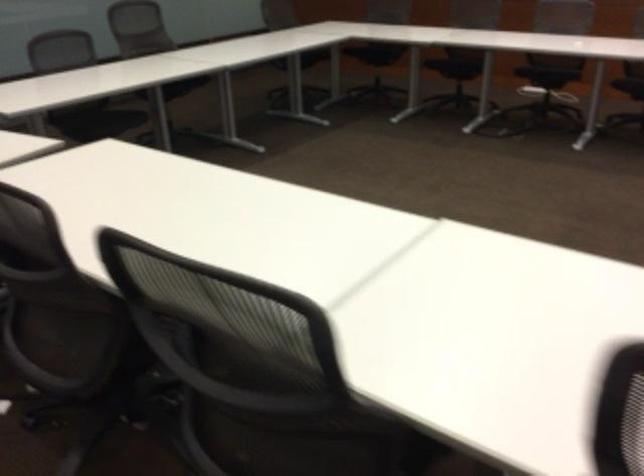
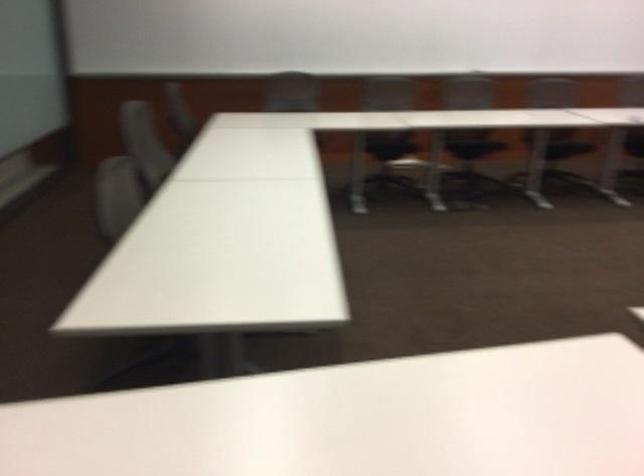
Question: What movement of the cameraman would produce the second image?

Choices:
 (A) Left
 (B) Right
 (C) Forward
 (D) Backward

Answer: (D)